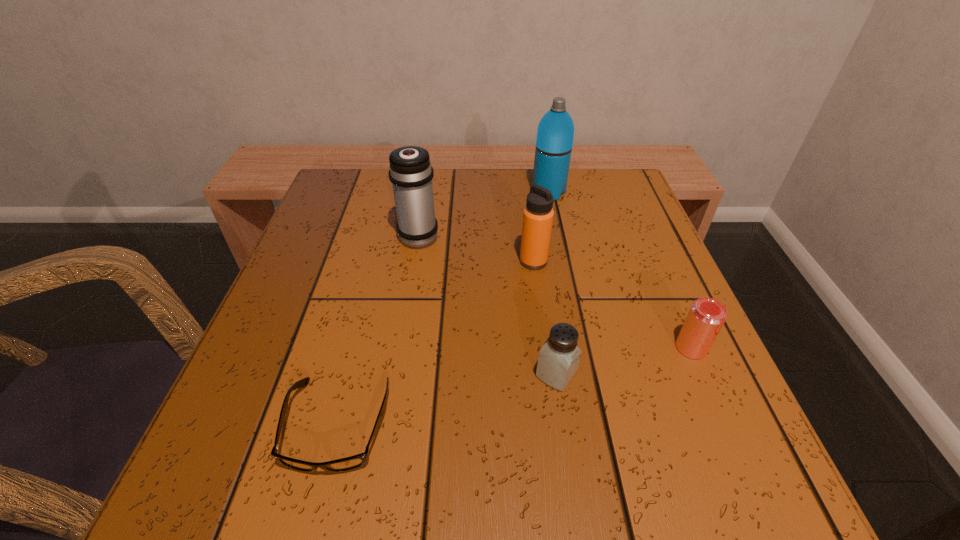
Identify which thermos bottle is located as the second nearest to the farthest object. Please provide its 2D coordinates. Your answer should be formatted as a tuple, i.e. [(x, y)], where the tuple contains the x and y coordinates of a point satisfying the conditions above.

[(411, 173)]